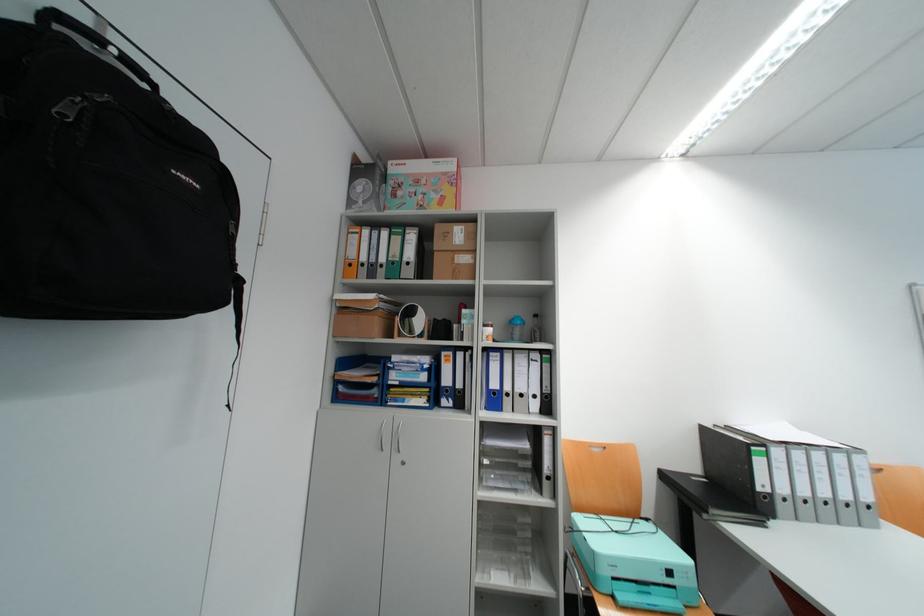
The width and height of the screenshot is (924, 616). What do you see at coordinates (637, 569) in the screenshot? I see `the printer scanner lid` at bounding box center [637, 569].